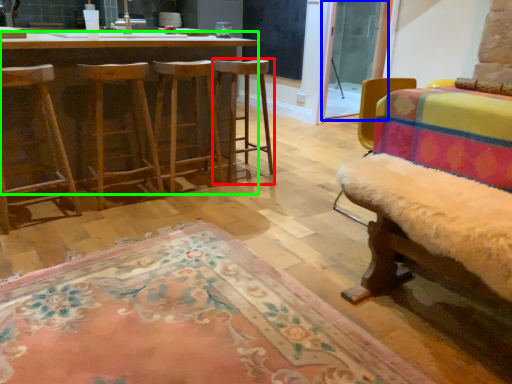
Question: Which is nearer to the stool (highlighted by a red box)? screen door (highlighted by a blue box) or desk (highlighted by a green box).

Choices:
 (A) screen door
 (B) desk

Answer: (B)